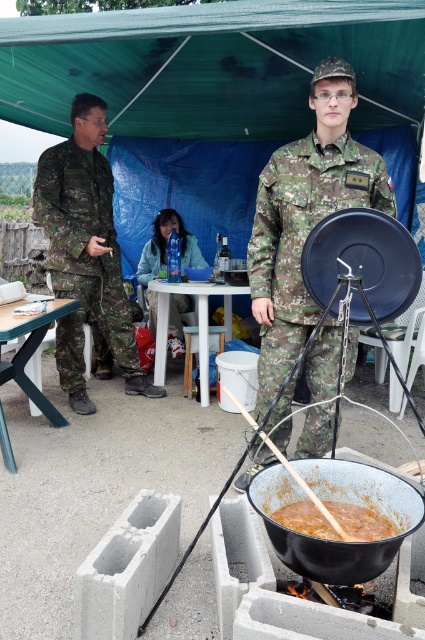
Can you confirm if camouflage fabric uniform at center is wider than camouflage fabric uniform at left?

Yes, camouflage fabric uniform at center is wider than camouflage fabric uniform at left.

Which is more to the left, camouflage fabric uniform at center or camouflage fabric uniform at left?

Positioned to the left is camouflage fabric uniform at left.

Between point (263, 369) and point (70, 248), which one is positioned behind?

The point (70, 248) is more distant.

Find the location of a particular element. This screenshot has height=640, width=425. camouflage fabric uniform at center is located at coordinates (302, 236).

Does green plastic picnic table at lower left lie in front of white plastic picnic table at center?

Yes, green plastic picnic table at lower left is closer to the viewer.

Is green plastic picnic table at lower left further to camera compared to white plastic picnic table at center?

No, it is in front of white plastic picnic table at center.

Describe the element at coordinates (31, 348) in the screenshot. The height and width of the screenshot is (640, 425). I see `green plastic picnic table at lower left` at that location.

At what (x,y) coordinates should I click in order to perform the action: click on green plastic picnic table at lower left. Please return your answer as a coordinate pair (x, y). Looking at the image, I should click on [31, 348].

Is camouflage fabric uniform at center to the right of white plastic picnic table at center from the viewer's perspective?

Indeed, camouflage fabric uniform at center is positioned on the right side of white plastic picnic table at center.

Does camouflage fabric uniform at center have a greater width compared to white plastic picnic table at center?

In fact, camouflage fabric uniform at center might be narrower than white plastic picnic table at center.

Which is in front, point (263, 339) or point (195, 292)?

Point (263, 339) is more forward.

This screenshot has width=425, height=640. In order to click on camouflage fabric uniform at center in this screenshot , I will do `click(302, 236)`.